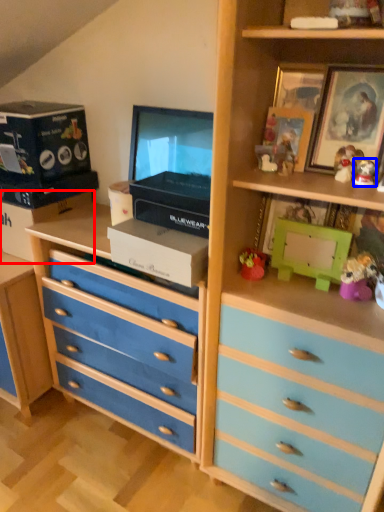
Question: Which object appears closest to the camera in this image, box (highlighted by a red box) or toy (highlighted by a blue box)?

Choices:
 (A) box
 (B) toy

Answer: (B)